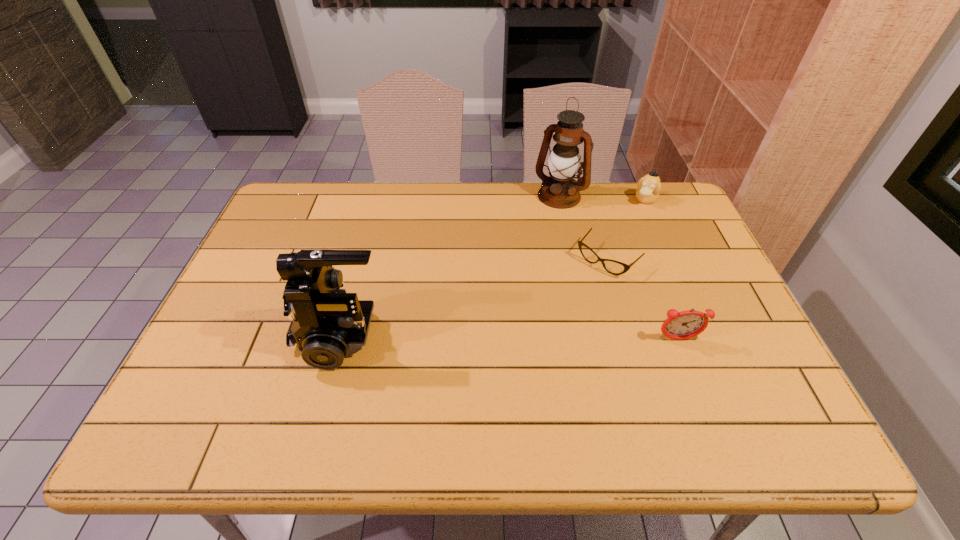
Locate an element on the screen. vacant space located on the front-facing side of the shortest object is located at coordinates (559, 310).

The width and height of the screenshot is (960, 540). I want to click on vacant space located on the front-facing side of the shortest object, so pos(561,308).

I want to click on vacant space situated on the front-facing side of the shortest object, so click(x=516, y=354).

Identify the location of free space located on the face of the duckling. The image size is (960, 540). (631, 225).

What are the coordinates of `vacant space located 0.370m on the face of the duckling` in the screenshot? It's located at (599, 276).

The height and width of the screenshot is (540, 960). Find the location of `free space located on the face of the duckling`. free space located on the face of the duckling is located at coordinates (629, 229).

I want to click on blank area located 0.380m on the side of the lantern, there is a wick adjustment knob, so click(496, 282).

In order to click on vacant area situated on the side of the lantern, there is a wick adjustment knob in this screenshot , I will do `click(516, 253)`.

The width and height of the screenshot is (960, 540). What are the coordinates of `vacant space located 0.370m on the side of the lantern, there is a wick adjustment knob` in the screenshot? It's located at (498, 279).

What are the coordinates of `duckling located in the far edge section of the desktop` in the screenshot? It's located at (649, 186).